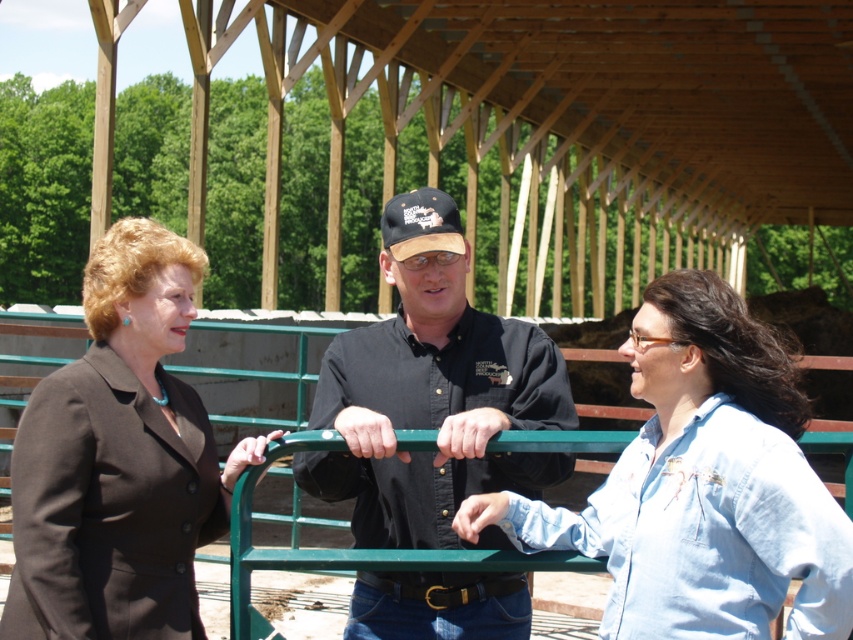
Image resolution: width=853 pixels, height=640 pixels. What do you see at coordinates (701, 484) in the screenshot? I see `blue denim shirt at center` at bounding box center [701, 484].

Is the position of blue denim shirt at center more distant than that of black cotton shirt at center?

No, blue denim shirt at center is in front of black cotton shirt at center.

Is point (648, 563) positioned behind point (425, 269)?

No, it is not.

The image size is (853, 640). What are the coordinates of `blue denim shirt at center` in the screenshot? It's located at 701,484.

Can you confirm if blue denim shirt at center is positioned to the left of matte black suit at left?

No, blue denim shirt at center is not to the left of matte black suit at left.

Measure the distance between blue denim shirt at center and camera.

12.65 feet

This screenshot has width=853, height=640. What do you see at coordinates (701, 484) in the screenshot?
I see `blue denim shirt at center` at bounding box center [701, 484].

You are a GUI agent. You are given a task and a screenshot of the screen. Output one action in this format:
    pyautogui.click(x=<x>, y=<y>)
    Task: Click on the blue denim shirt at center
    This screenshot has height=640, width=853.
    Given the screenshot: What is the action you would take?
    [x=701, y=484]

Is matte black shirt at center to the right of blue denim shirt at center from the viewer's perspective?

No, matte black shirt at center is not to the right of blue denim shirt at center.

Who is taller, matte black shirt at center or blue denim shirt at center?

matte black shirt at center

What do you see at coordinates (434, 394) in the screenshot? I see `matte black shirt at center` at bounding box center [434, 394].

Identify the location of matte black shirt at center. This screenshot has width=853, height=640. (434, 394).